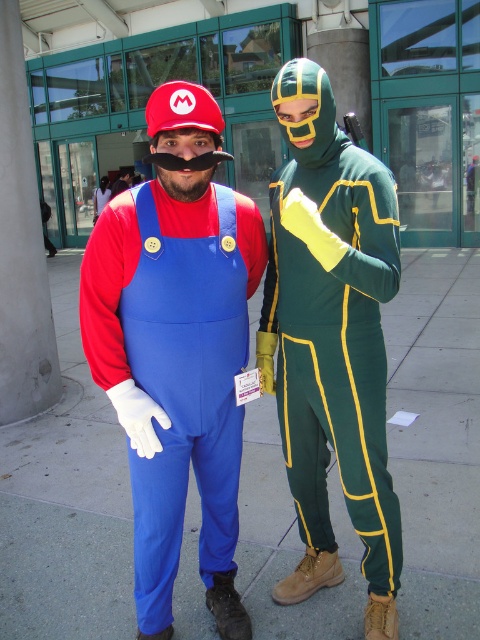
Is blue fabric pants at center bigger than green matte jumpsuit at center?

Incorrect, blue fabric pants at center is not larger than green matte jumpsuit at center.

Can you confirm if blue fabric pants at center is positioned to the left of green matte jumpsuit at center?

In fact, blue fabric pants at center is to the right of green matte jumpsuit at center.

The image size is (480, 640). In order to click on blue fabric pants at center in this screenshot , I will do `click(66, 502)`.

Between point (424, 497) and point (119, 406), which one is positioned behind?

The point (424, 497) is more distant.

Does blue fabric pants at center have a greater height compared to matte fabric mario costume at center?

Incorrect, blue fabric pants at center's height is not larger of matte fabric mario costume at center's.

The width and height of the screenshot is (480, 640). What do you see at coordinates (66, 502) in the screenshot?
I see `blue fabric pants at center` at bounding box center [66, 502].

Locate an element on the screen. Image resolution: width=480 pixels, height=640 pixels. blue fabric pants at center is located at coordinates (66, 502).

Does matte fabric mario costume at center appear on the right side of green matte jumpsuit at center?

Incorrect, matte fabric mario costume at center is not on the right side of green matte jumpsuit at center.

In the scene shown: Does matte fabric mario costume at center have a lesser height compared to green matte jumpsuit at center?

Correct, matte fabric mario costume at center is not as tall as green matte jumpsuit at center.

Which is in front, point (210, 609) or point (372, 220)?

Point (372, 220)

The height and width of the screenshot is (640, 480). In order to click on matte fabric mario costume at center in this screenshot , I will do `click(177, 348)`.